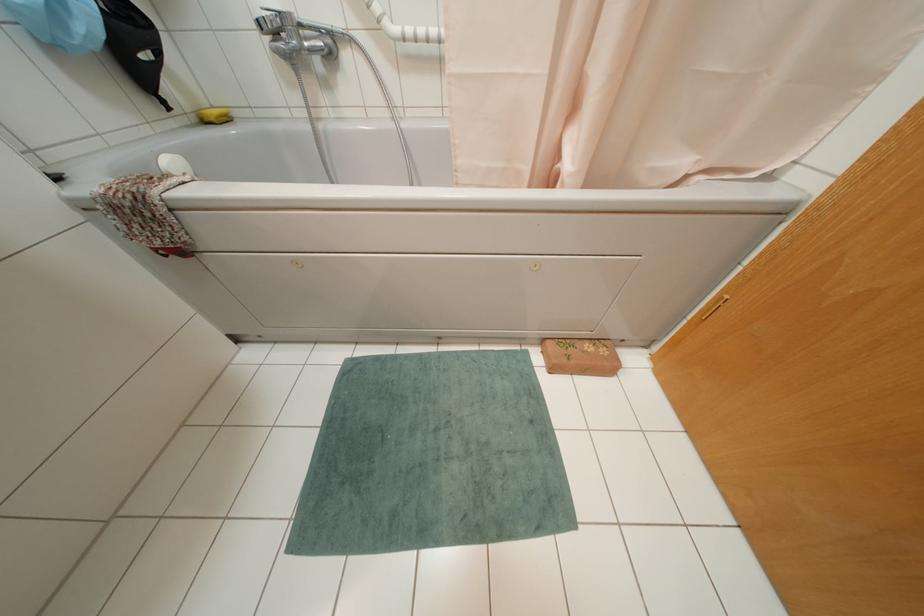
Where is `yellow sponge`? This screenshot has height=616, width=924. yellow sponge is located at coordinates coord(214,116).